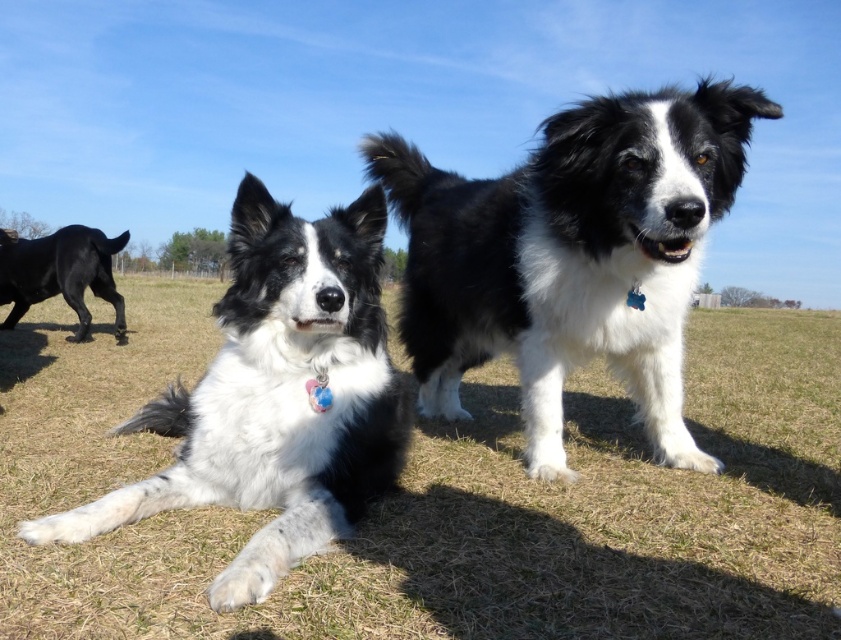
Is black and white fur dog at center bigger than black glossy dog at left?

Correct, black and white fur dog at center is larger in size than black glossy dog at left.

Is black and white fur dog at center in front of black glossy dog at left?

Yes, black and white fur dog at center is in front of black glossy dog at left.

Locate an element on the screen. This screenshot has width=841, height=640. black and white fur dog at center is located at coordinates (276, 397).

Does white fur dog at center have a greater height compared to black and white fur dog at center?

Incorrect, white fur dog at center's height is not larger of black and white fur dog at center's.

You are a GUI agent. You are given a task and a screenshot of the screen. Output one action in this format:
    pyautogui.click(x=<x>, y=<y>)
    Task: Click on the white fur dog at center
    The width and height of the screenshot is (841, 640).
    Given the screenshot: What is the action you would take?
    pyautogui.click(x=443, y=497)

Where is `white fur dog at center`? The height and width of the screenshot is (640, 841). white fur dog at center is located at coordinates (443, 497).

Is black and white fur at center taller than black and white fur dog at center?

Indeed, black and white fur at center has a greater height compared to black and white fur dog at center.

What do you see at coordinates (570, 257) in the screenshot?
I see `black and white fur at center` at bounding box center [570, 257].

Does point (601, 340) come farther from viewer compared to point (347, 337)?

Yes.

Identify the location of black and white fur at center. (570, 257).